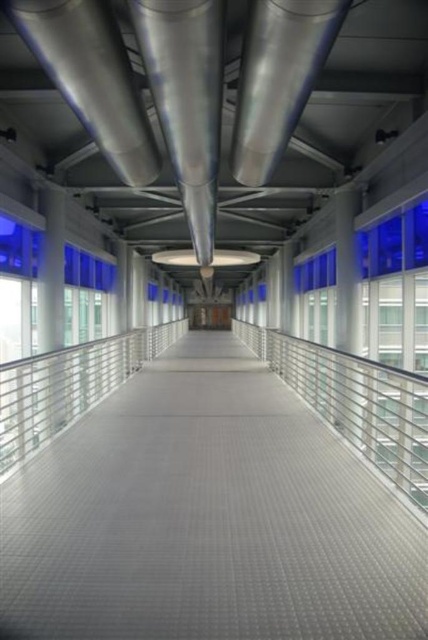
Question: Which object is the closest to the silver metallic pipe at upper center?

Choices:
 (A) gray textured walkway at center
 (B) white glossy pillar at left

Answer: (A)

Question: Which of these objects is positioned closest to the silver metallic rail at center?

Choices:
 (A) gray textured walkway at center
 (B) silver metallic pipe at center
 (C) silver metallic pipe at upper center

Answer: (A)

Question: Where is silver metallic pipe at center located in relation to silver metallic pipe at upper center in the image?

Choices:
 (A) below
 (B) above

Answer: (A)

Question: Which point is closer to the camera taking this photo?

Choices:
 (A) (41, 250)
 (B) (261, 13)
 (C) (107, 561)

Answer: (B)

Question: Does gray textured walkway at center appear over silver metallic rail at center?

Choices:
 (A) yes
 (B) no

Answer: (B)

Question: Can you confirm if silver metallic pipe at center is positioned above white glossy pillar at left?

Choices:
 (A) no
 (B) yes

Answer: (B)